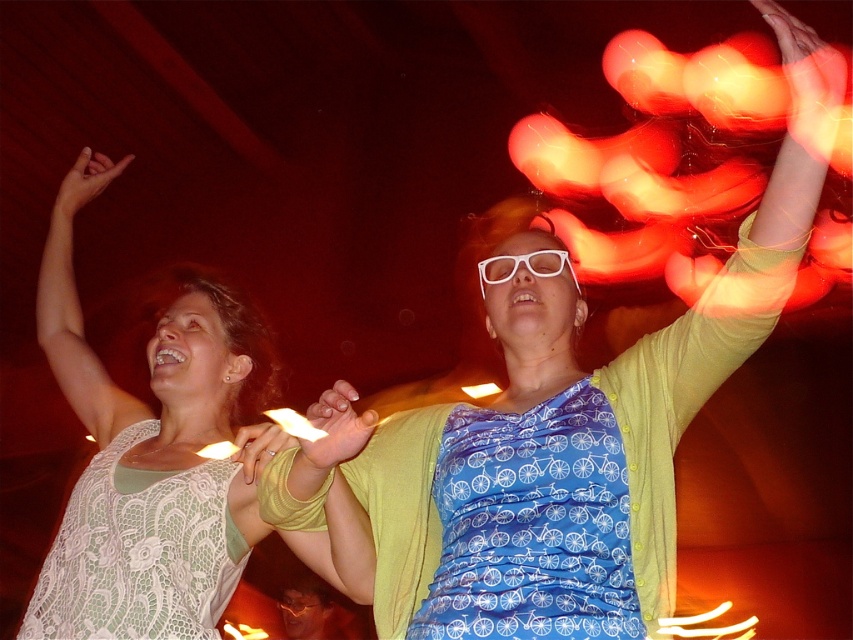
You are a photographer trying to capture a clear shot of both the white lace dress at upper left and the smooth yellow hand at center. However, you notice that one of them is blocking the other. Which object is covering the other in the image?

The white lace dress at upper left is positioned over the smooth yellow hand at center, so the dress is covering the hand in the image.

You are standing in the same position as the photographer who took this image. There are two points marked in the scene, point A at coordinates point [136,400] and point B at point [289,605]. If you were to walk towards point A, would you pass point B first before reaching point A?

Point A at coordinates point [136,400] is in front of point B at point [289,605]. Therefore, if you walk towards point A, you would reach point A before encountering point B. Since point A is closer to your position, you wouldn not pass point B first.